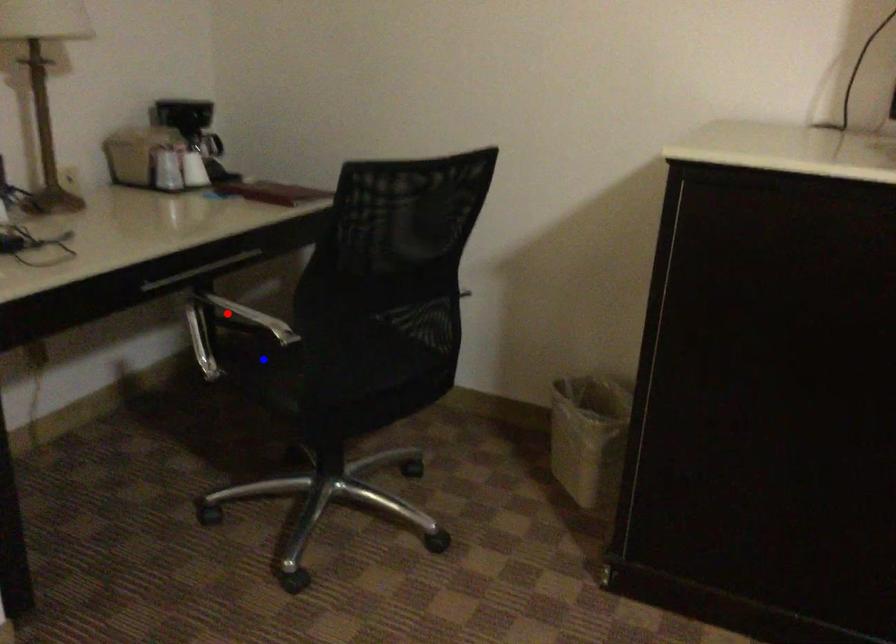
Question: Which of the two points in the image is closer to the camera?

Choices:
 (A) Blue point is closer.
 (B) Red point is closer.

Answer: (A)